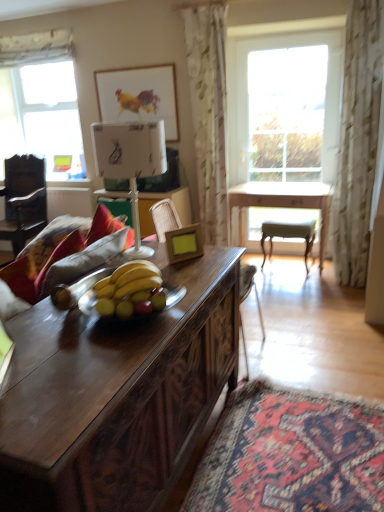
Question: In terms of width, does watercolor paper picture frame at upper center, marked as the 2th picture frame in a bottom-to-top arrangement, look wider or thinner when compared to white paper lampshade at center?

Choices:
 (A) thin
 (B) wide

Answer: (A)

Question: Considering the positions of watercolor paper picture frame at upper center, placed as the first picture frame when sorted from left to right, and white paper lampshade at center in the image, is watercolor paper picture frame at upper center, placed as the first picture frame when sorted from left to right, bigger or smaller than white paper lampshade at center?

Choices:
 (A) small
 (B) big

Answer: (A)

Question: Which object is the farthest from the wooden picture frame at center, which appears as the first picture frame when ordered from the bottom?

Choices:
 (A) watercolor paper picture frame at upper center, marked as the 2th picture frame in a bottom-to-top arrangement
 (B) light wood table at center
 (C) clear glass window at center, the first window from the front
 (D) white paper lampshade at center
 (E) wooden swivel chair at center

Answer: (C)

Question: Based on their relative distances, which object is farther from the wooden picture frame at center, which is the second picture frame from left to right?

Choices:
 (A) clear glass window at center, which is counted as the 2th window, starting from the back
 (B) white paper lampshade at center
 (C) light wood table at center
 (D) green fabric chair at center
 (E) clear glass window at upper left, which is the 1th window in back-to-front order

Answer: (E)